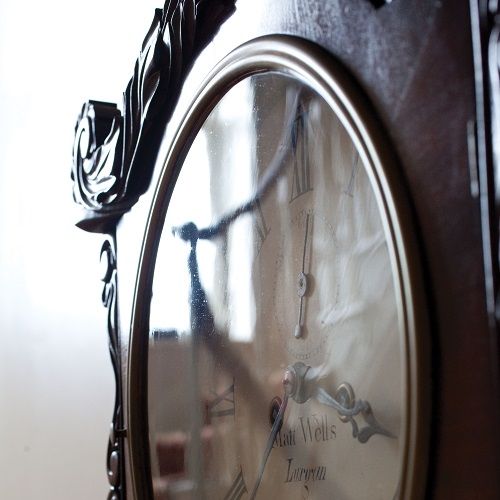
Where is `clock arms`? The height and width of the screenshot is (500, 500). clock arms is located at coordinates (269, 445), (355, 411), (303, 280).